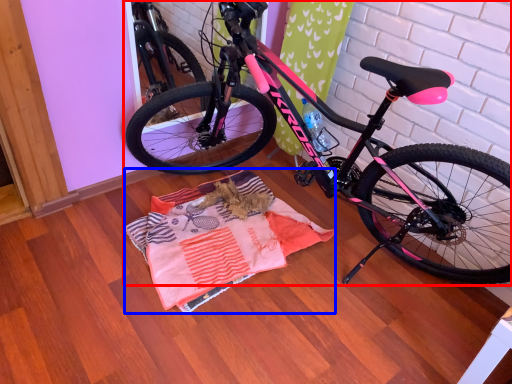
Question: Among these objects, which one is farthest to the camera, bicycle (highlighted by a red box) or blanket (highlighted by a blue box)?

Choices:
 (A) bicycle
 (B) blanket

Answer: (B)